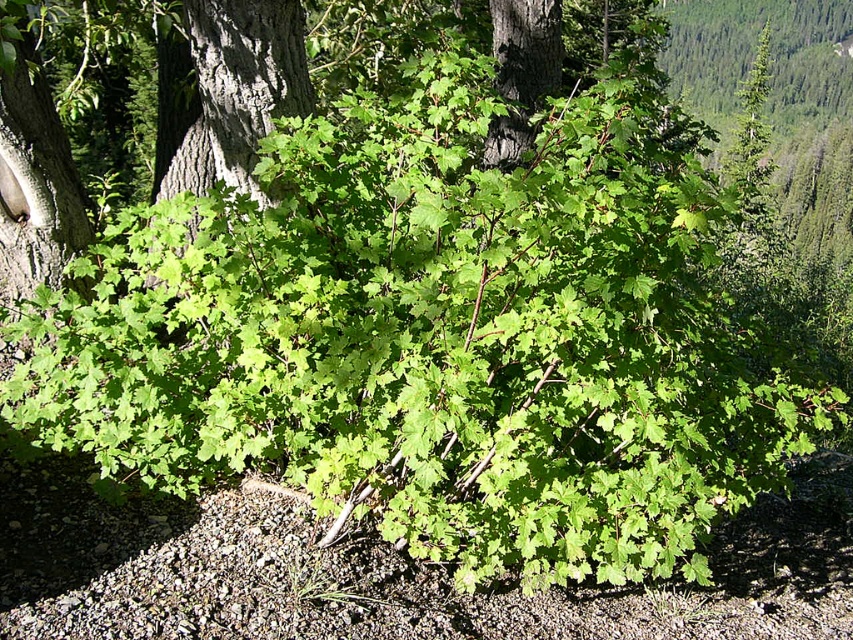
Can you confirm if smooth gray bark at center is shorter than dark brown bark at center?

Yes, smooth gray bark at center is shorter than dark brown bark at center.

Does smooth gray bark at center have a larger size compared to dark brown bark at center?

Indeed, smooth gray bark at center has a larger size compared to dark brown bark at center.

What do you see at coordinates (225, 92) in the screenshot?
I see `smooth gray bark at center` at bounding box center [225, 92].

Locate an element on the screen. The height and width of the screenshot is (640, 853). smooth gray bark at center is located at coordinates (225, 92).